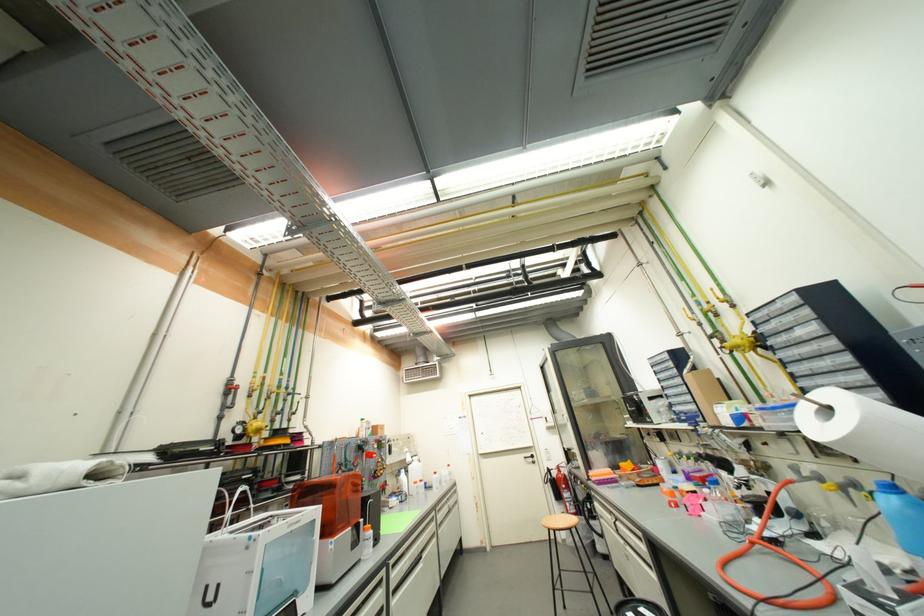
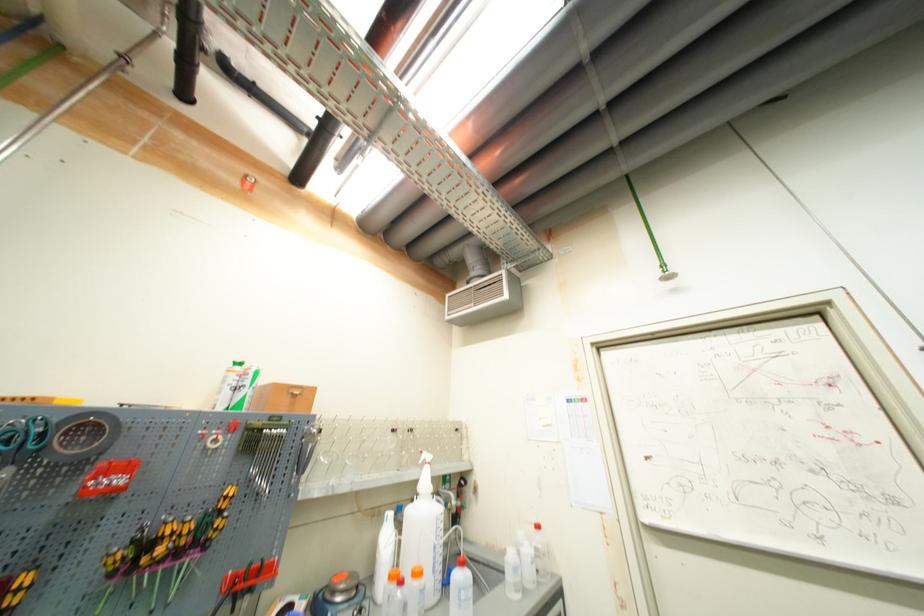
Locate, in the second image, the point that corresponds to pixel 410 461 in the first image.

(421, 484)